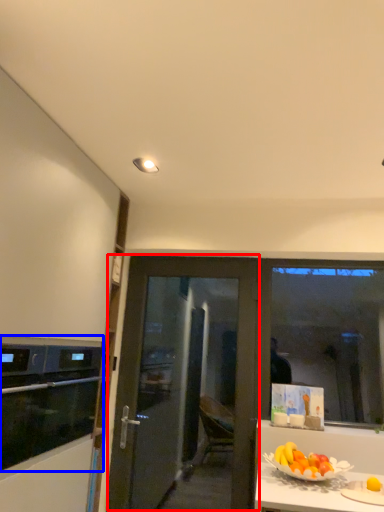
Question: Which of the following is the farthest to the observer, door (highlighted by a red box) or kitchen appliance (highlighted by a blue box)?

Choices:
 (A) door
 (B) kitchen appliance

Answer: (A)